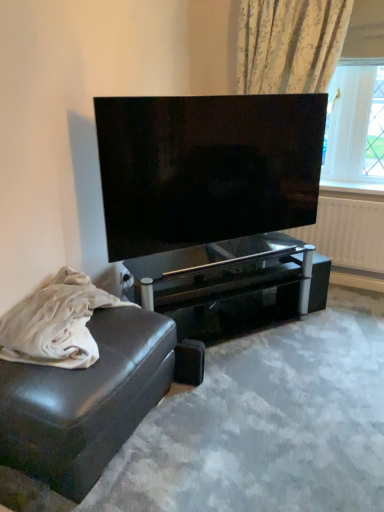
I want to click on white glossy radiator at upper right, so click(x=348, y=233).

Locate an element on the screen. leather couch at lower left is located at coordinates (85, 401).

What do you see at coordinates (85, 401) in the screenshot? This screenshot has height=512, width=384. I see `leather couch at lower left` at bounding box center [85, 401].

At what (x,y) coordinates should I click in order to perform the action: click on matte black tv at center. Please return your answer as a coordinate pair (x, y). Looking at the image, I should click on click(206, 168).

At what (x,y) coordinates should I click in order to perform the action: click on white glossy radiator at upper right. Please return your answer as a coordinate pair (x, y). Looking at the image, I should click on (348, 233).

Does point (312, 114) come in front of point (151, 318)?

No, (312, 114) is behind (151, 318).

The image size is (384, 512). What are the coordinates of `studio couch below the matte black tv at center (from the image's perspective)` in the screenshot? It's located at (85, 401).

Would you consider matte black tv at center to be distant from leather couch at lower left?

No.

Which of these two, matte black tv at center or leather couch at lower left, is wider?

leather couch at lower left is wider.

Could you tell me if black glass table at center is turned towards leather couch at lower left?

No, black glass table at center is not facing towards leather couch at lower left.

From the image's perspective, which one is positioned higher, black glass table at center or leather couch at lower left?

black glass table at center is shown above in the image.

Can you confirm if black glass table at center is smaller than leather couch at lower left?

Actually, black glass table at center might be larger than leather couch at lower left.

Consider the image. How different are the orientations of leather couch at lower left and black glass table at center in degrees?

The facing directions of leather couch at lower left and black glass table at center are 38.5 degrees apart.

From the image's perspective, who appears lower, leather couch at lower left or black glass table at center?

From the image's view, leather couch at lower left is below.

Considering the relative positions of leather couch at lower left and black glass table at center in the image provided, is leather couch at lower left to the left of black glass table at center from the viewer's perspective?

Correct, you'll find leather couch at lower left to the left of black glass table at center.

Is leather couch at lower left surrounding black glass table at center?

No, black glass table at center is not a part of leather couch at lower left.

In the image, is white glossy radiator at upper right on the left side or the right side of matte black tv at center?

In the image, white glossy radiator at upper right appears on the right side of matte black tv at center.

Is white glossy radiator at upper right taller or shorter than matte black tv at center?

In the image, white glossy radiator at upper right appears to be shorter than matte black tv at center.

Is white glossy radiator at upper right positioned with its back to matte black tv at center?

white glossy radiator at upper right does not have its back to matte black tv at center.

Is white glossy radiator at upper right completely or partially outside of matte black tv at center?

Absolutely, white glossy radiator at upper right is external to matte black tv at center.

Is matte black tv at center bigger than leather couch at lower left?

Correct, matte black tv at center is larger in size than leather couch at lower left.

From a real-world perspective, between matte black tv at center and leather couch at lower left, who is vertically higher?

matte black tv at center is physically above.

Is point (168, 211) closer or farther from the camera than point (40, 354)?

Point (168, 211).

Looking at this image, is matte black tv at center located within leather couch at lower left?

No.

You are a GUI agent. You are given a task and a screenshot of the screen. Output one action in this format:
    pyautogui.click(x=<x>, y=<y>)
    Task: Click on the television located behind the leather couch at lower left
    
    Given the screenshot: What is the action you would take?
    pyautogui.click(x=206, y=168)

Based on the photo, is the surface of leather couch at lower left in direct contact with matte black tv at center?

leather couch at lower left and matte black tv at center are clearly separated.

Is leather couch at lower left aimed at matte black tv at center?

No, leather couch at lower left is not facing towards matte black tv at center.

From a real-world perspective, is white glossy radiator at upper right above or below leather couch at lower left?

Clearly, from a real-world perspective, white glossy radiator at upper right is below leather couch at lower left.

Can you confirm if white glossy radiator at upper right is bigger than leather couch at lower left?

Actually, white glossy radiator at upper right might be smaller than leather couch at lower left.

What's the angular difference between white glossy radiator at upper right and leather couch at lower left's facing directions?

The facing directions of white glossy radiator at upper right and leather couch at lower left are 91.7 degrees apart.

Considering the relative positions of white glossy radiator at upper right and leather couch at lower left in the image provided, is white glossy radiator at upper right behind leather couch at lower left?

Yes, white glossy radiator at upper right is further from the viewer.

This screenshot has width=384, height=512. Find the location of `television behind the leather couch at lower left`. television behind the leather couch at lower left is located at coordinates (206, 168).

Where is `material below the black glass table at center (from the image's perspective)`? The image size is (384, 512). material below the black glass table at center (from the image's perspective) is located at coordinates (56, 323).

Considering their positions, is leather couch at lower left positioned closer to matte black tv at center than white glossy radiator at upper right?

The object closer to matte black tv at center is leather couch at lower left.

From the image, which object appears to be farther from matte black tv at center, leather couch at lower left or black glass table at center?

leather couch at lower left is further to matte black tv at center.

Looking at the image, which one is located further to leather couch at lower left, matte black tv at center or leather couch at lower left?

The object further to leather couch at lower left is matte black tv at center.

Estimate the real-world distances between objects in this image. Which object is further from black glass table at center, leather couch at lower left or leather couch at lower left?

Among the two, leather couch at lower left is located further to black glass table at center.

Looking at the image, which one is located further to white glossy radiator at upper right, matte black tv at center or leather couch at lower left?

Based on the image, leather couch at lower left appears to be further to white glossy radiator at upper right.

Looking at the image, which one is located closer to leather couch at lower left, matte black tv at center or leather couch at lower left?

Among the two, leather couch at lower left is located nearer to leather couch at lower left.

Looking at the image, which one is located further to matte black tv at center, white glossy radiator at upper right or black glass table at center?

The object further to matte black tv at center is white glossy radiator at upper right.

When comparing their distances from leather couch at lower left, does white glossy radiator at upper right or black glass table at center seem further?

white glossy radiator at upper right.

Identify the location of material located between leather couch at lower left and black glass table at center in the depth direction. (56, 323).

Find the location of a particular element. television between leather couch at lower left and white glossy radiator at upper right along the z-axis is located at coordinates (206, 168).

This screenshot has height=512, width=384. I want to click on television between leather couch at lower left and white glossy radiator at upper right from front to back, so click(x=206, y=168).

In order to click on table between matte black tv at center and white glossy radiator at upper right from front to back in this screenshot , I will do tap(231, 285).